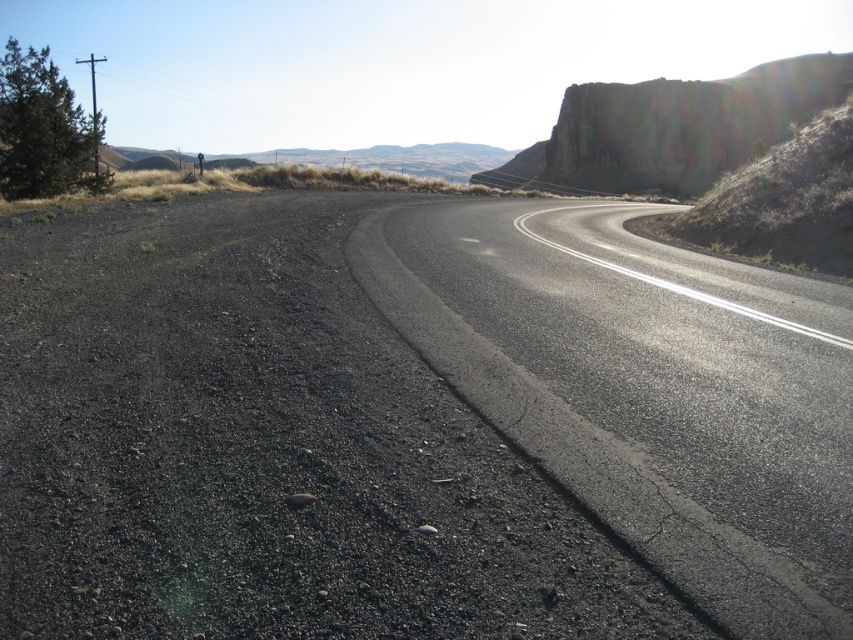
Who is lower down, black asphalt road at center or rugged rock cliff at upper right?

black asphalt road at center is lower down.

Based on the photo, is black asphalt road at center above rugged rock cliff at upper right?

Actually, black asphalt road at center is below rugged rock cliff at upper right.

Does point (730, 362) come in front of point (526, 148)?

Yes, point (730, 362) is closer to viewer.

Where is `black asphalt road at center`? black asphalt road at center is located at coordinates (645, 390).